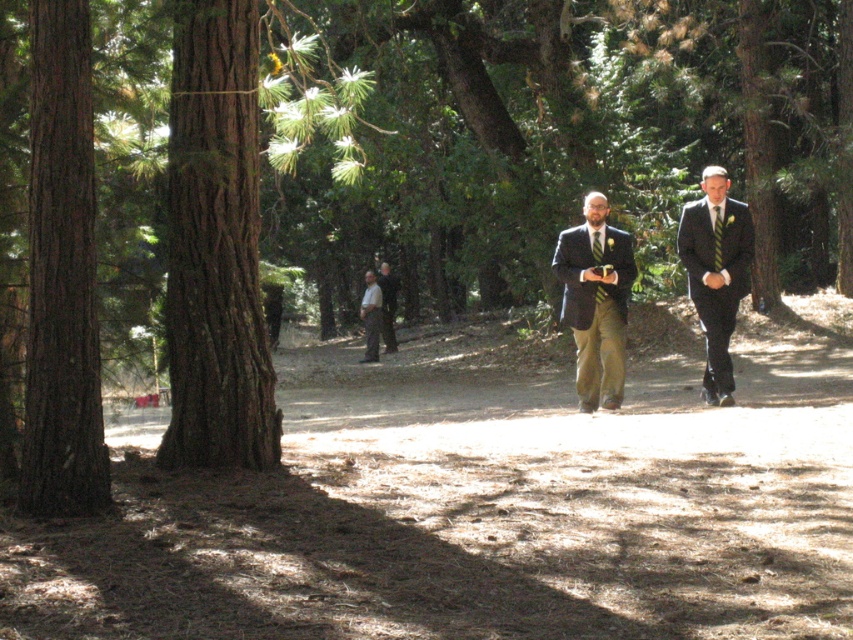
Question: Can you confirm if brown rough bark tree at left is positioned below smooth brown bark at left?

Choices:
 (A) yes
 (B) no

Answer: (B)

Question: Among these objects, which one is nearest to the camera?

Choices:
 (A) light brown leather jacket at center
 (B) smooth brown bark at left
 (C) matte black suit at center
 (D) black suit at right

Answer: (B)

Question: Is brown rough bark tree at left above black suit at right?

Choices:
 (A) yes
 (B) no

Answer: (A)

Question: Which of the following is the farthest from the observer?

Choices:
 (A) dirt path at center
 (B) brown rough bark tree at left
 (C) matte black suit at center
 (D) light brown leather jacket at center

Answer: (D)

Question: Is smooth brown bark at left bigger than dark gray suit at center?

Choices:
 (A) yes
 (B) no

Answer: (B)

Question: Which of the following is the closest to the observer?

Choices:
 (A) (67, 122)
 (B) (595, 333)
 (C) (367, 326)

Answer: (A)